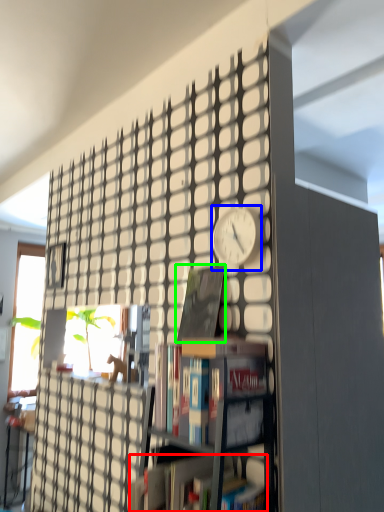
Question: Considering the real-world distances, which object is farthest from book (highlighted by a red box)? clock (highlighted by a blue box) or book (highlighted by a green box)?

Choices:
 (A) clock
 (B) book

Answer: (A)